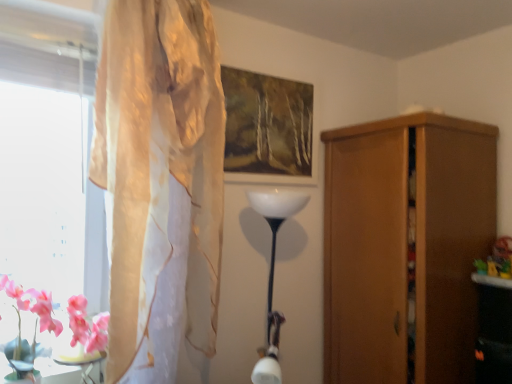
Question: Is pink glossy table at lower left a part of matte wooden picture frame at upper center?

Choices:
 (A) no
 (B) yes

Answer: (A)

Question: Is matte wooden picture frame at upper center far from pink glossy table at lower left?

Choices:
 (A) yes
 (B) no

Answer: (A)

Question: Is matte wooden picture frame at upper center shorter than pink glossy table at lower left?

Choices:
 (A) no
 (B) yes

Answer: (A)

Question: Is matte wooden picture frame at upper center positioned in front of pink glossy table at lower left?

Choices:
 (A) yes
 (B) no

Answer: (B)

Question: From the image's perspective, is matte wooden picture frame at upper center over pink glossy table at lower left?

Choices:
 (A) no
 (B) yes

Answer: (B)

Question: Does matte wooden picture frame at upper center turn towards pink glossy table at lower left?

Choices:
 (A) no
 (B) yes

Answer: (A)

Question: Is matte wooden picture frame at upper center oriented towards pink silk flowers at lower left?

Choices:
 (A) yes
 (B) no

Answer: (B)

Question: Considering the relative positions of matte wooden picture frame at upper center and pink silk flowers at lower left in the image provided, is matte wooden picture frame at upper center behind pink silk flowers at lower left?

Choices:
 (A) yes
 (B) no

Answer: (A)

Question: Can you confirm if matte wooden picture frame at upper center is shorter than pink silk flowers at lower left?

Choices:
 (A) yes
 (B) no

Answer: (B)

Question: From the image's perspective, is matte wooden picture frame at upper center beneath pink silk flowers at lower left?

Choices:
 (A) no
 (B) yes

Answer: (A)

Question: Does matte wooden picture frame at upper center have a lesser width compared to pink silk flowers at lower left?

Choices:
 (A) no
 (B) yes

Answer: (B)

Question: Is matte wooden picture frame at upper center to the right of pink silk flowers at lower left from the viewer's perspective?

Choices:
 (A) yes
 (B) no

Answer: (A)

Question: Considering the relative sizes of pink silk flowers at lower left and translucent beige curtain at left in the image provided, is pink silk flowers at lower left wider than translucent beige curtain at left?

Choices:
 (A) no
 (B) yes

Answer: (A)